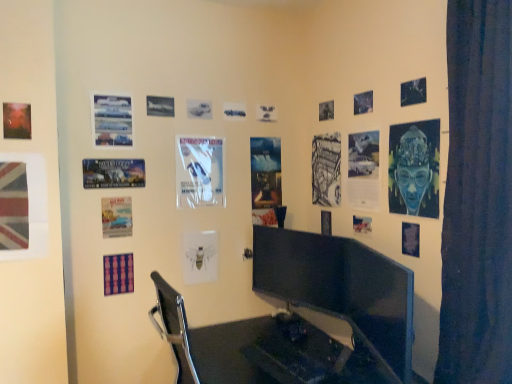
Question: Is metallic airplane at upper center, the 7th poster page positioned from the left, in front of or behind matte red poster at upper left, which is the sixteenth poster page from right to left, in the image?

Choices:
 (A) front
 (B) behind

Answer: (B)

Question: Considering the positions of metallic airplane at upper center, the 7th poster page positioned from the left, and matte red poster at upper left, which is the sixteenth poster page from right to left, in the image, is metallic airplane at upper center, the 7th poster page positioned from the left, taller or shorter than matte red poster at upper left, which is the sixteenth poster page from right to left,?

Choices:
 (A) short
 (B) tall

Answer: (A)

Question: Which object is positioned farthest from the blue paper at lower right, positioned as the 17th poster page in left-to-right order?

Choices:
 (A) matte black monitor at center, the 2th computer monitor from the left
 (B) white glossy poster at center, acting as the 9th poster page starting from the left
 (C) metallic silver poster at upper right, marked as the 3th poster page in a right-to-left arrangement
 (D) dark blue fabric curtain at right
 (E) union jack flag at left, acting as the seventeenth poster page starting from the right

Answer: (E)

Question: Based on their relative distances, which object is nearer to the matte paper poster at center, which appears as the eighth poster page when viewed from the right?

Choices:
 (A) matte paper poster at lower left, which appears as the 5th poster page when viewed from the left
 (B) purple fabric poster at lower left, which appears as the sixth poster page when viewed from the left
 (C) white glossy poster at center, acting as the 9th poster page starting from the left
 (D) blue textured fabric at upper right, which is the second poster page from right to left
 (E) matte red poster at upper left, which is the sixteenth poster page from right to left

Answer: (C)